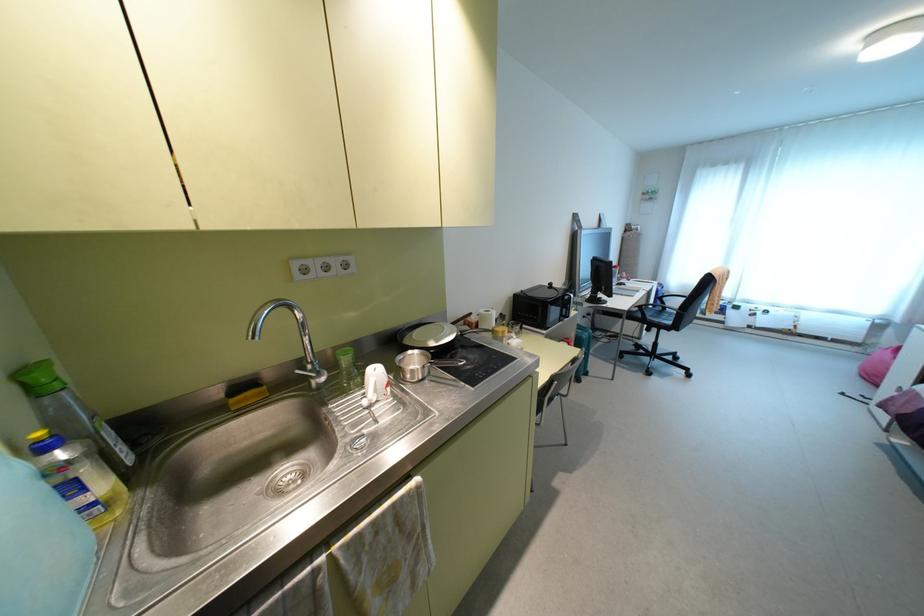
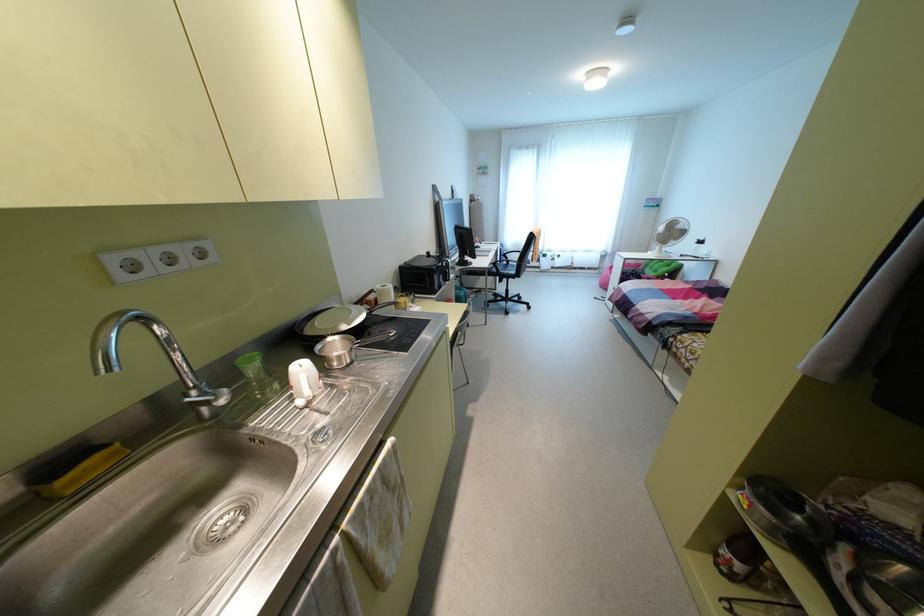
Where in the second image is the point corresponding to (435,341) from the first image?

(348, 323)